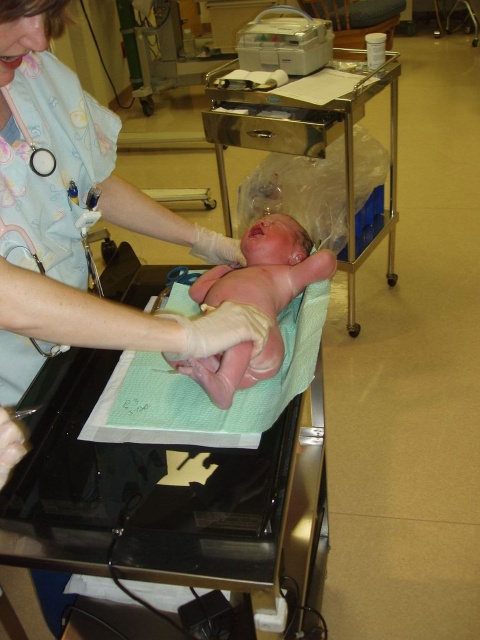
Question: Which point is closer to the camera?

Choices:
 (A) (199, 374)
 (B) (352, 278)

Answer: (A)

Question: Can you confirm if stainless steel cart at upper center is positioned above pink smooth newborn at center?

Choices:
 (A) yes
 (B) no

Answer: (A)

Question: Does stainless steel cart at upper center appear under pink smooth newborn at center?

Choices:
 (A) yes
 (B) no

Answer: (B)

Question: Can you confirm if stainless steel cart at upper center is smaller than pink smooth newborn at center?

Choices:
 (A) yes
 (B) no

Answer: (B)

Question: Among these points, which one is farthest from the camera?

Choices:
 (A) (223, 150)
 (B) (245, 262)

Answer: (A)